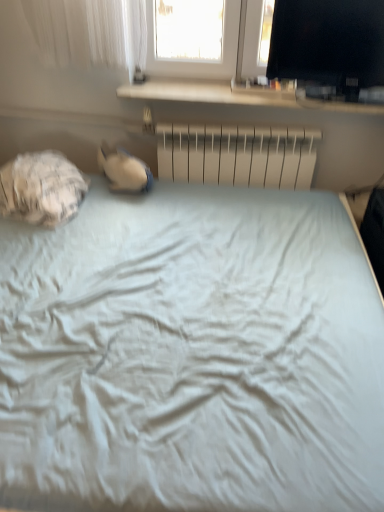
Question: Considering the relative positions of white textured sleeping bag at left and black glossy monitor at upper right in the image provided, is white textured sleeping bag at left to the left or to the right of black glossy monitor at upper right?

Choices:
 (A) left
 (B) right

Answer: (A)

Question: In terms of height, does white textured sleeping bag at left look taller or shorter compared to black glossy monitor at upper right?

Choices:
 (A) short
 (B) tall

Answer: (A)

Question: Estimate the real-world distances between objects in this image. Which object is farther from the black glossy monitor at upper right?

Choices:
 (A) metallic silver radiator at center
 (B) white textured sleeping bag at left

Answer: (B)

Question: Considering the real-world distances, which object is closest to the metallic silver radiator at center?

Choices:
 (A) white textured sleeping bag at left
 (B) black glossy monitor at upper right

Answer: (B)